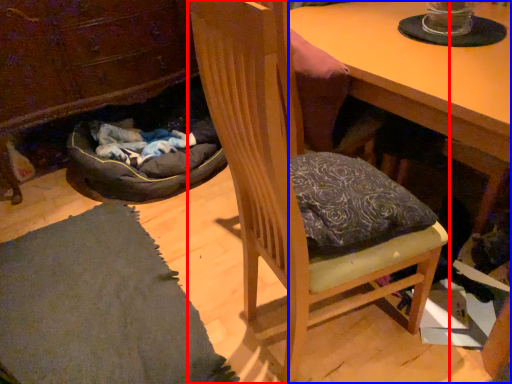
Question: Which of the following is the closest to the observer, chair (highlighted by a red box) or desk (highlighted by a blue box)?

Choices:
 (A) chair
 (B) desk

Answer: (A)